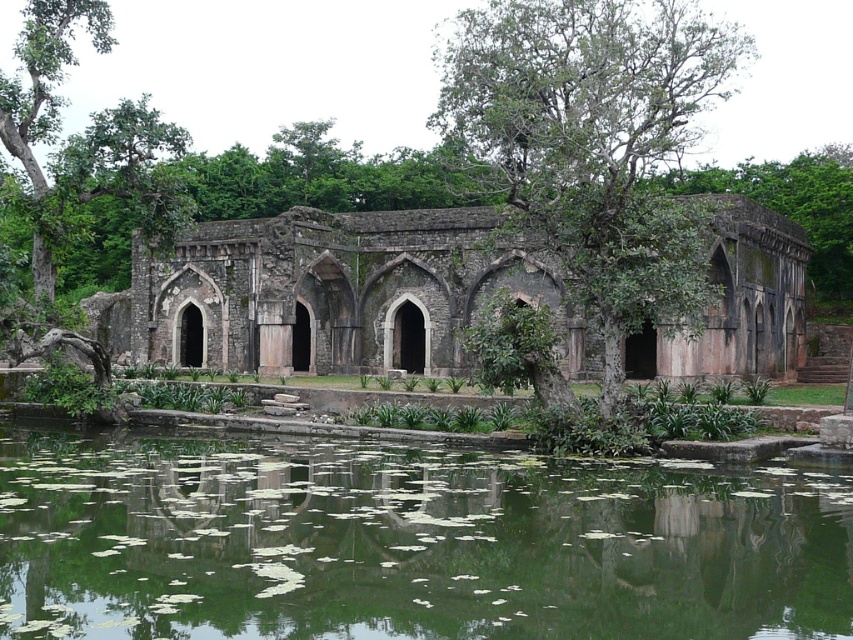
Question: Estimate the real-world distances between objects in this image. Which object is closer to the green leafy tree at center?

Choices:
 (A) green reflective water at center
 (B) rustic stone building at center

Answer: (B)

Question: Does green reflective water at center have a lesser width compared to rustic stone building at center?

Choices:
 (A) no
 (B) yes

Answer: (B)

Question: Based on their relative distances, which object is nearer to the green leafy tree at center?

Choices:
 (A) rustic stone building at center
 (B) green reflective water at center

Answer: (A)

Question: Estimate the real-world distances between objects in this image. Which object is farther from the rustic stone building at center?

Choices:
 (A) green leafy tree at center
 (B) green reflective water at center

Answer: (B)

Question: Can you confirm if green reflective water at center is positioned below rustic stone building at center?

Choices:
 (A) yes
 (B) no

Answer: (A)

Question: Is green reflective water at center below green leafy tree at center?

Choices:
 (A) yes
 (B) no

Answer: (A)